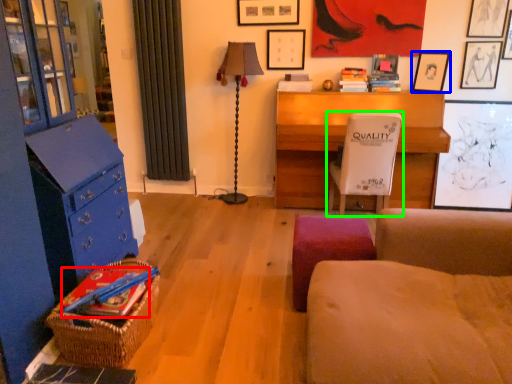
Question: Based on their relative distances, which object is nearer to book (highlighted by a red box)? Choose from picture frame (highlighted by a blue box) and chair (highlighted by a green box).

Choices:
 (A) picture frame
 (B) chair

Answer: (B)